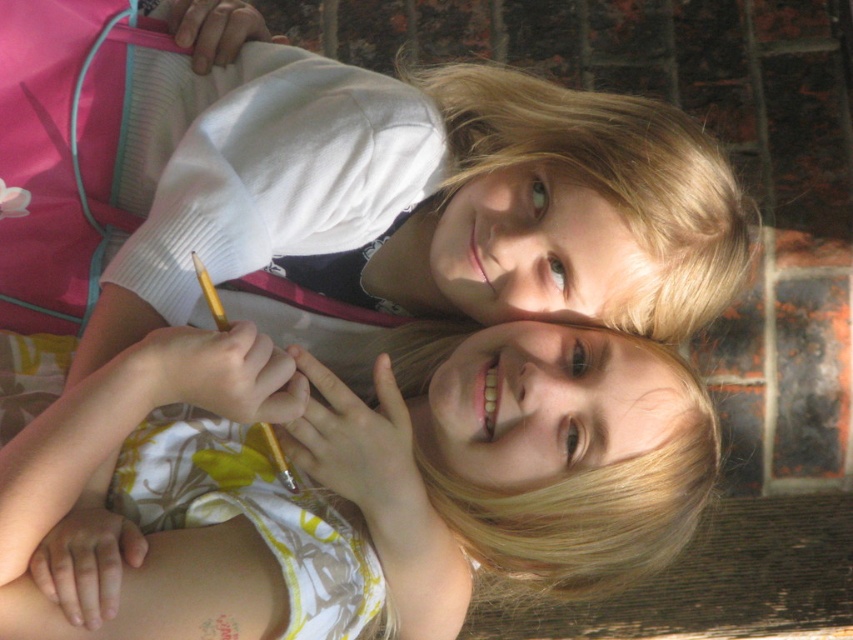
Question: Can you confirm if white floral dress at center is wider than matte white shirt at upper center?

Choices:
 (A) yes
 (B) no

Answer: (B)

Question: In this image, where is white floral dress at center located relative to matte white shirt at upper center?

Choices:
 (A) left
 (B) right

Answer: (A)

Question: In this image, where is white floral dress at center located relative to matte white shirt at upper center?

Choices:
 (A) left
 (B) right

Answer: (A)

Question: Which of the following is the farthest from the observer?

Choices:
 (A) (645, 157)
 (B) (351, 488)

Answer: (B)